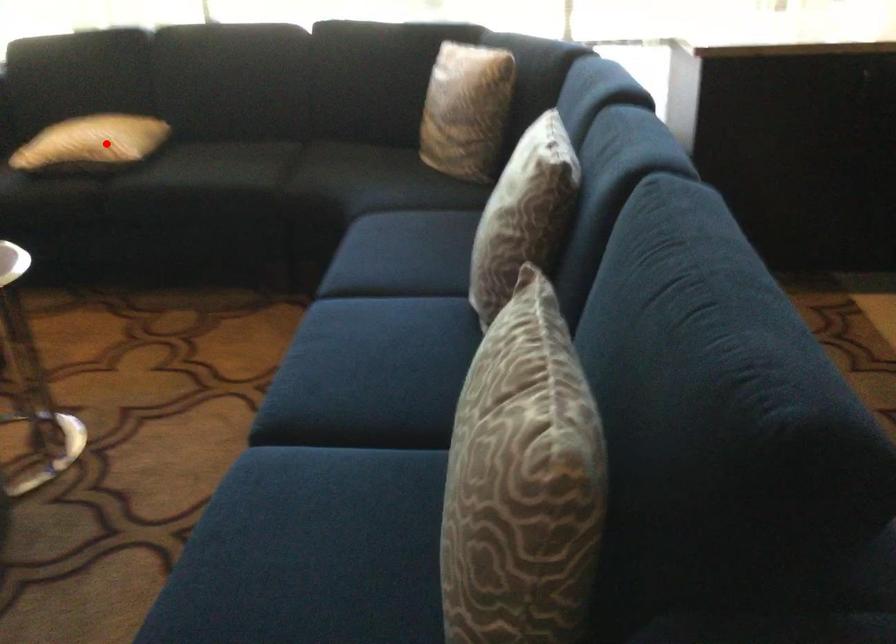
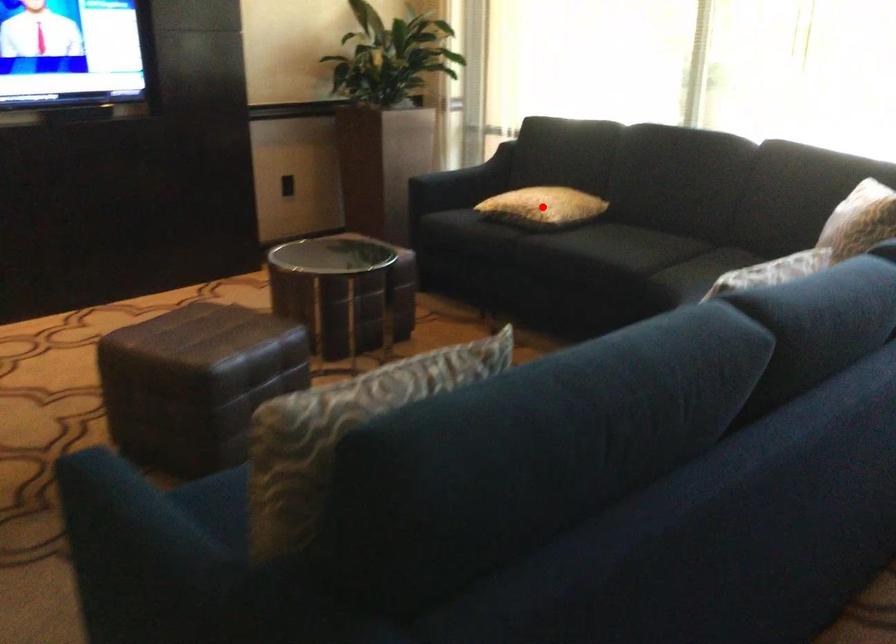
I am providing you with two images of the same scene from different viewpoints. A red point is marked on the first image and another point is marked on the second image. Is the marked point in image1 the same physical position as the marked point in image2?

Yes